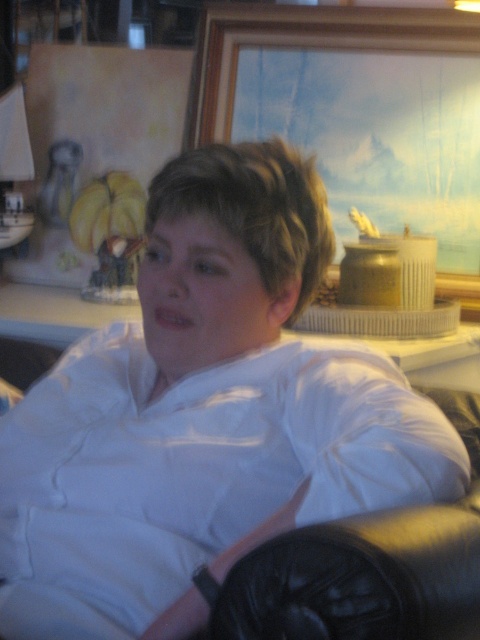
You are arranging items on a shelf and must place the wooden picture frame at upper center and the yellow matte bananas at upper left. Based on the scene, which item is placed higher?

The wooden picture frame at upper center is positioned over the yellow matte bananas at upper left, meaning it is placed higher.

You are standing in a room and see a wooden picture frame at upper center. If you want to place a small plant pot exactly at point (x=309, y=45), will it be placed on top of the wooden picture frame at upper center?

The point (x=309, y=45) is where the wooden picture frame at upper center is located, so placing the plant pot there would put it on top of the wooden picture frame at upper center.

You are an interior designer assessing the living room layout. You need to determine if the wooden picture frame at upper center can be moved to the right without disturbing the yellow matte bananas at upper left. Based on their current positions, is this possible?

The wooden picture frame at upper center is in front of the yellow matte bananas at upper left, so moving it to the right would not disturb the bananas since they are positioned behind the frame.